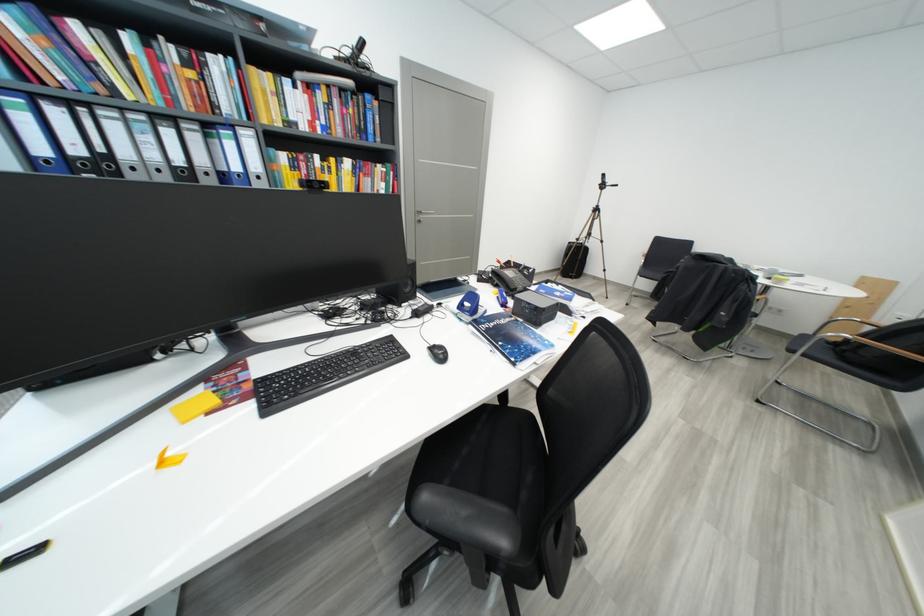
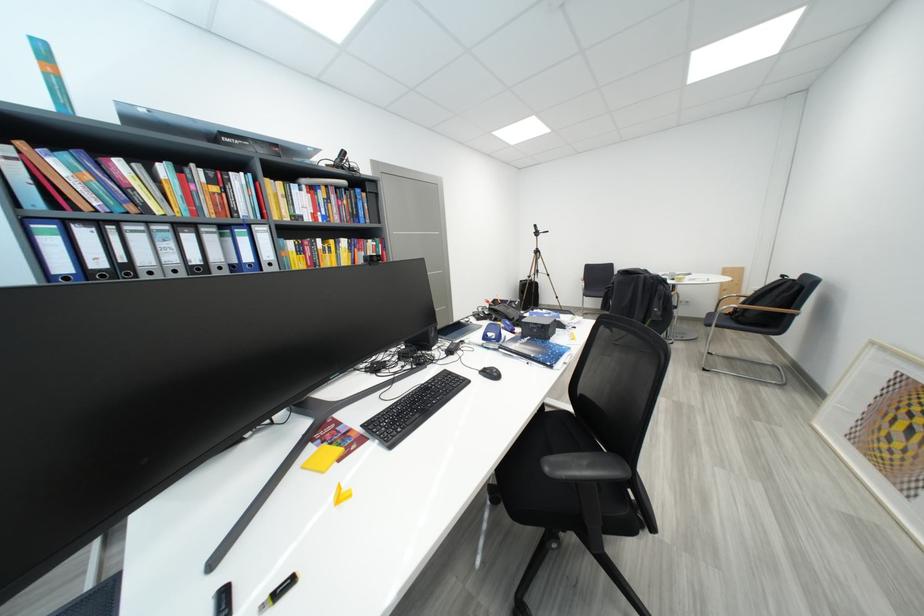
Where in the second image is the point corresponding to the point at 447,357 from the first image?

(501, 377)